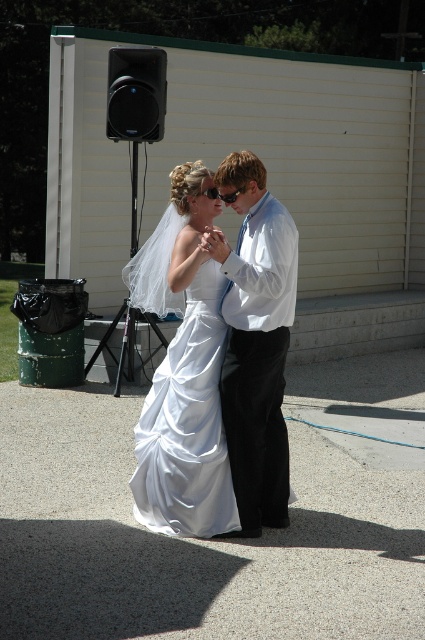
You are a photographer standing 3 meters away from the white satin shirt at center. You want to take a photo of the couple but need to be exactly 5 meters away from the camera. Can you move to the correct position?

The white satin shirt at center and camera are 5.75 meters apart. Since you are already 3 meters away from the white satin shirt at center, you need to move an additional 2.75 meters towards the camera to be exactly 5 meters from it. This position would place you 5 meters from the camera while maintaining your distance from the shirt.

You are a photographer at a wedding and need to adjust the lighting to ensure both the white satin shirt at center and the satin white dress at center are well illuminated. Given their height difference, where should you position the light source to evenly light both?

The white satin shirt at center is much taller than the satin white dress at center. Position the light source at a moderate height between the two to evenly illuminate both.

You are a photographer at a wedding and need to position yourself so that the white satin shirt at center and the black plastic speaker at upper left are both visible in your shot. Based on their positions, which object should you ensure is placed higher in the frame to include both?

The white satin shirt at center is below the black plastic speaker at upper left, so to include both in the frame, ensure the black plastic speaker at upper left is placed higher in the frame.